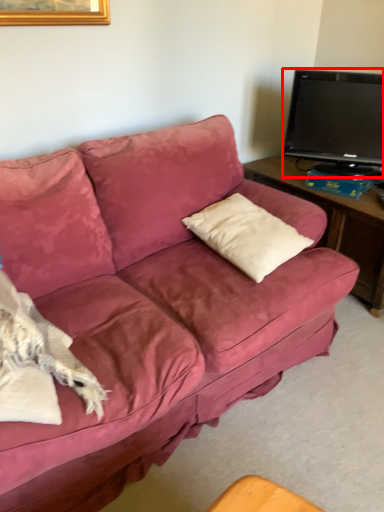
Question: Where is television (annotated by the red box) located in relation to throw pillow in the image?

Choices:
 (A) right
 (B) left

Answer: (A)